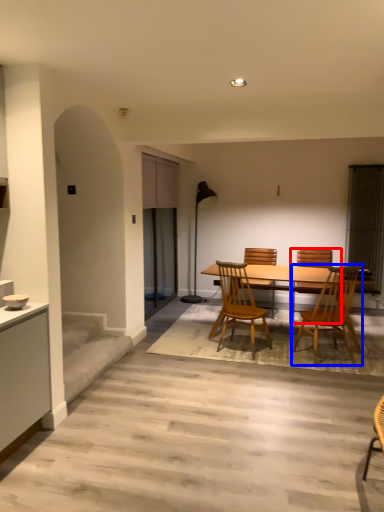
Question: Which point is closer to the camera, chair (highlighted by a red box) or chair (highlighted by a blue box)?

Choices:
 (A) chair
 (B) chair

Answer: (B)